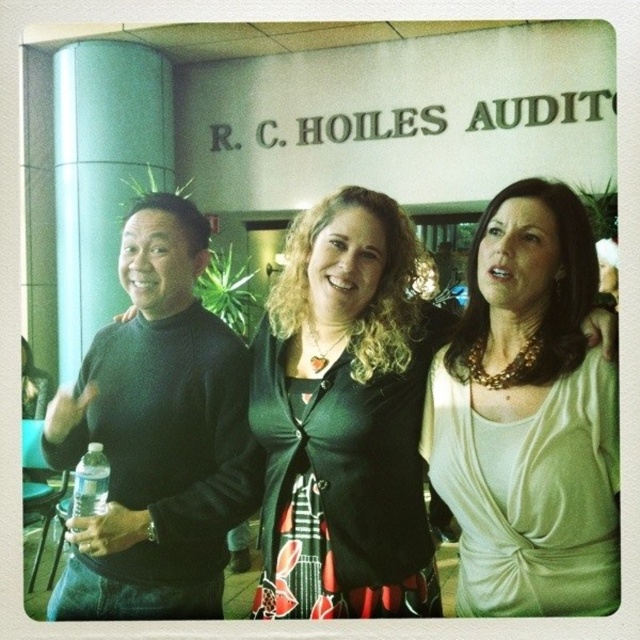
You are a photographer at the event and need to adjust the lighting to ensure both the black matte cardigan at center and the clear plastic bottle at lower left are visible. Which object should you focus on first to avoid reflections?

The clear plastic bottle at lower left should be focused on first because it is made of clear plastic and may reflect more light, requiring adjustments to reduce glare before focusing on the black matte cardigan at center.

You are a fashion designer observing this scene. You need to determine which clothing item is shorter between the white satin blouse at center and the black matte sweater at left. Based on the description, which one is shorter?

The white satin blouse at center is shorter than the black matte sweater at left according to the description.

Based on the scene description, which clothing item is positioned to the right of the other? The white satin blouse at center or the black matte sweater at left?

The white satin blouse at center is to the right of the black matte sweater at left.